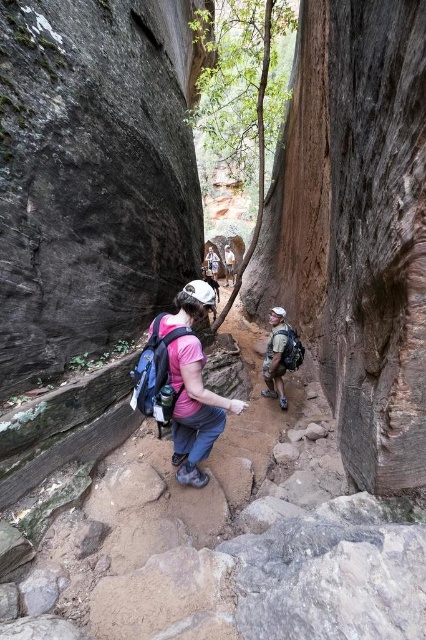
You are a photographer planning to take a photo of the matte pink shirt at center and the matte gray backpack at center in the canyon. Based on their sizes, which object should you focus on to ensure both fit within the frame without cropping?

The matte pink shirt at center is wider than the matte gray backpack at center. To ensure both fit without cropping, focus on the wider matte pink shirt at center as it requires more space in the frame.

You are a hiker planning to join the group in the slot canyon. You see the matte pink shirt at center and the matte gray backpack at center. Which object is closer to the ground?

The matte pink shirt at center is positioned under the matte gray backpack at center, so the matte pink shirt at center is closer to the ground.

You are a photographer trying to capture the hikers in the slot canyon. You notice the matte pink shirt at center and the matte gray backpack at center. Which object should you focus on to ensure it appears larger in your photo?

The matte pink shirt at center is bigger than the matte gray backpack at center, so focusing on the matte pink shirt at center will make it appear larger in the photo.